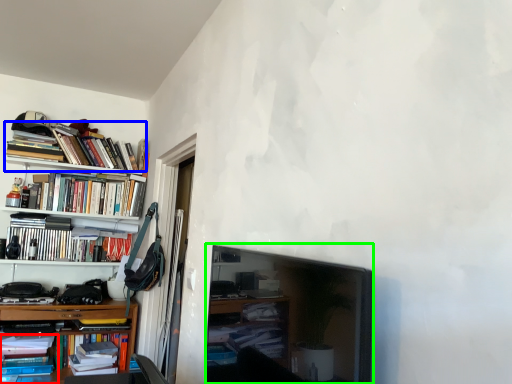
Question: Based on their relative distances, which object is farther from book (highlighted by a red box)? Choose from book (highlighted by a blue box) and picture frame (highlighted by a green box).

Choices:
 (A) book
 (B) picture frame

Answer: (B)